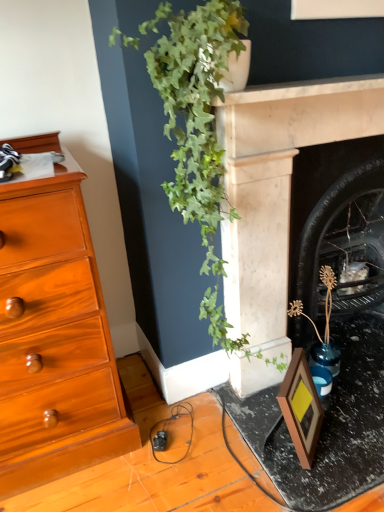
Describe the element at coordinates (207, 168) in the screenshot. I see `green leafy plant at upper center` at that location.

What are the coordinates of `green leafy plant at upper center` in the screenshot? It's located at (207, 168).

Image resolution: width=384 pixels, height=512 pixels. Find the location of `green leafy plant at upper center`. green leafy plant at upper center is located at coordinates (207, 168).

Based on the photo, considering the sizes of objects wooden picture frame at lower right and matte black frame at lower right in the image provided, who is bigger, wooden picture frame at lower right or matte black frame at lower right?

matte black frame at lower right is bigger.

Is wooden picture frame at lower right in front of or behind matte black frame at lower right in the image?

Clearly, wooden picture frame at lower right is behind matte black frame at lower right.

From a real-world perspective, who is located lower, wooden picture frame at lower right or matte black frame at lower right?

matte black frame at lower right.

Where is `table that is under the wooden picture frame at lower right (from a real-world perspective)`? This screenshot has height=512, width=384. table that is under the wooden picture frame at lower right (from a real-world perspective) is located at coordinates (325, 424).

Is matte black frame at lower right shorter than green leafy plant at upper center?

Correct, matte black frame at lower right is not as tall as green leafy plant at upper center.

From the image's perspective, does matte black frame at lower right appear higher than green leafy plant at upper center?

Incorrect, from the image's perspective, matte black frame at lower right is lower than green leafy plant at upper center.

Could you tell me if matte black frame at lower right is facing green leafy plant at upper center?

No, matte black frame at lower right does not turn towards green leafy plant at upper center.

Can you see marble fireplace at center-right, which is the 1th fireplace in front-to-back order, touching green leafy plant at upper center?

No, marble fireplace at center-right, which is the 1th fireplace in front-to-back order, is not in contact with green leafy plant at upper center.

From the image's perspective, would you say marble fireplace at center-right, the 2th fireplace viewed from the back, is positioned over green leafy plant at upper center?

No, from the image's perspective, marble fireplace at center-right, the 2th fireplace viewed from the back, is not on top of green leafy plant at upper center.

Looking at the image, does marble fireplace at center-right, which is the 1th fireplace in front-to-back order, seem bigger or smaller compared to green leafy plant at upper center?

Considering their sizes, marble fireplace at center-right, which is the 1th fireplace in front-to-back order, takes up less space than green leafy plant at upper center.

Can you confirm if marble fireplace at center-right, the 2th fireplace viewed from the back, is shorter than green leafy plant at upper center?

In fact, marble fireplace at center-right, the 2th fireplace viewed from the back, may be taller than green leafy plant at upper center.

Between point (304, 388) and point (279, 224), which one is positioned in front?

The point (304, 388) is closer.

Is wooden picture frame at lower right oriented towards marble fireplace at center-right, the 2th fireplace viewed from the back?

No, wooden picture frame at lower right is not turned towards marble fireplace at center-right, the 2th fireplace viewed from the back.

Can you tell me how much wooden picture frame at lower right and marble fireplace at center-right, which is the 1th fireplace in front-to-back order, differ in facing direction?

43.4 degrees separate the facing orientations of wooden picture frame at lower right and marble fireplace at center-right, which is the 1th fireplace in front-to-back order.

Based on the photo, who is taller, wooden picture frame at lower right or marble fireplace at center-right, the 2th fireplace viewed from the back?

With more height is marble fireplace at center-right, the 2th fireplace viewed from the back.

What's the angular difference between matte black frame at lower right and marble fireplace at center-right, which is the 1th fireplace in front-to-back order,'s facing directions?

The angular difference between matte black frame at lower right and marble fireplace at center-right, which is the 1th fireplace in front-to-back order, is 2 degrees.

Considering the sizes of matte black frame at lower right and marble fireplace at center-right, the 2th fireplace viewed from the back, in the image, is matte black frame at lower right bigger or smaller than marble fireplace at center-right, the 2th fireplace viewed from the back,?

Considering their sizes, matte black frame at lower right takes up less space than marble fireplace at center-right, the 2th fireplace viewed from the back.

The image size is (384, 512). I want to click on table located on the right of marble fireplace at center-right, which is the 1th fireplace in front-to-back order, so click(x=325, y=424).

Considering the relative sizes of matte black frame at lower right and marble fireplace at center-right, the 2th fireplace viewed from the back, in the image provided, is matte black frame at lower right wider than marble fireplace at center-right, the 2th fireplace viewed from the back,?

Indeed, matte black frame at lower right has a greater width compared to marble fireplace at center-right, the 2th fireplace viewed from the back.

Does wooden picture frame at lower right have a lesser height compared to green leafy plant at upper center?

Correct, wooden picture frame at lower right is not as tall as green leafy plant at upper center.

How many degrees apart are the facing directions of wooden picture frame at lower right and green leafy plant at upper center?

40.5 degrees separate the facing orientations of wooden picture frame at lower right and green leafy plant at upper center.

Between point (307, 381) and point (260, 373), which one is positioned behind?

The point (260, 373) is farther.

Does wooden picture frame at lower right turn towards green leafy plant at upper center?

No, wooden picture frame at lower right is not facing towards green leafy plant at upper center.

Is green leafy plant at upper center positioned far away from black marble fireplace at center-right, which is the second fireplace in front-to-back order?

No, green leafy plant at upper center is not far away from black marble fireplace at center-right, which is the second fireplace in front-to-back order.

Considering the relative sizes of green leafy plant at upper center and black marble fireplace at center-right, which is the second fireplace in front-to-back order, in the image provided, is green leafy plant at upper center shorter than black marble fireplace at center-right, which is the second fireplace in front-to-back order,?

In fact, green leafy plant at upper center may be taller than black marble fireplace at center-right, which is the second fireplace in front-to-back order.

Considering the sizes of objects green leafy plant at upper center and black marble fireplace at center-right, marked as the 1th fireplace in a back-to-front arrangement, in the image provided, who is wider, green leafy plant at upper center or black marble fireplace at center-right, marked as the 1th fireplace in a back-to-front arrangement,?

With larger width is green leafy plant at upper center.

Find the location of a particular element. The width and height of the screenshot is (384, 512). the 2nd fireplace positioned below the green leafy plant at upper center (from a real-world perspective) is located at coordinates (321, 185).

At what (x,y) coordinates should I click in order to perform the action: click on table below the wooden picture frame at lower right (from a real-world perspective). Please return your answer as a coordinate pair (x, y). This screenshot has width=384, height=512. Looking at the image, I should click on (325, 424).

Find the location of `table on the right of green leafy plant at upper center`. table on the right of green leafy plant at upper center is located at coordinates (325, 424).

Looking at the image, which one is located closer to marble fireplace at center-right, the 2th fireplace viewed from the back, wooden picture frame at lower right or green leafy plant at upper center?

The object closer to marble fireplace at center-right, the 2th fireplace viewed from the back, is green leafy plant at upper center.

Looking at the image, which one is located closer to black marble fireplace at center-right, marked as the 1th fireplace in a back-to-front arrangement, wooden picture frame at lower right or marble fireplace at center-right, the 2th fireplace viewed from the back?

marble fireplace at center-right, the 2th fireplace viewed from the back.

Considering their positions, is wooden picture frame at lower right positioned further to matte black frame at lower right than green leafy plant at upper center?

Based on the image, green leafy plant at upper center appears to be further to matte black frame at lower right.

Considering their positions, is marble fireplace at center-right, which is the 1th fireplace in front-to-back order, positioned further to black marble fireplace at center-right, marked as the 1th fireplace in a back-to-front arrangement, than wooden picture frame at lower right?

wooden picture frame at lower right is further to black marble fireplace at center-right, marked as the 1th fireplace in a back-to-front arrangement.

Looking at the image, which one is located closer to green leafy plant at upper center, wooden picture frame at lower right or matte black frame at lower right?

wooden picture frame at lower right is positioned closer to the anchor green leafy plant at upper center.

When comparing their distances from matte black frame at lower right, does green leafy plant at upper center or wooden picture frame at lower right seem closer?

The object closer to matte black frame at lower right is wooden picture frame at lower right.

From the image, which object appears to be nearer to black marble fireplace at center-right, marked as the 1th fireplace in a back-to-front arrangement, matte black frame at lower right or green leafy plant at upper center?

green leafy plant at upper center is positioned closer to the anchor black marble fireplace at center-right, marked as the 1th fireplace in a back-to-front arrangement.

Looking at this image, based on their spatial positions, is marble fireplace at center-right, the 2th fireplace viewed from the back, or black marble fireplace at center-right, which is the second fireplace in front-to-back order, closer to matte black frame at lower right?

marble fireplace at center-right, the 2th fireplace viewed from the back, lies closer to matte black frame at lower right than the other object.

Locate an element on the screen. The image size is (384, 512). fireplace between black marble fireplace at center-right, which is the second fireplace in front-to-back order, and matte black frame at lower right from top to bottom is located at coordinates (278, 186).

Where is `picture frame between marble fireplace at center-right, the 2th fireplace viewed from the back, and matte black frame at lower right vertically`? The height and width of the screenshot is (512, 384). picture frame between marble fireplace at center-right, the 2th fireplace viewed from the back, and matte black frame at lower right vertically is located at coordinates 301,407.

You are a GUI agent. You are given a task and a screenshot of the screen. Output one action in this format:
    pyautogui.click(x=<x>, y=<y>)
    Task: Click on the fireplace located between green leafy plant at upper center and black marble fireplace at center-right, which is the second fireplace in front-to-back order, in the left-right direction
    This screenshot has height=512, width=384.
    Given the screenshot: What is the action you would take?
    pyautogui.click(x=278, y=186)

Where is `fireplace between black marble fireplace at center-right, which is the second fireplace in front-to-back order, and wooden picture frame at lower right vertically`? fireplace between black marble fireplace at center-right, which is the second fireplace in front-to-back order, and wooden picture frame at lower right vertically is located at coordinates (278, 186).